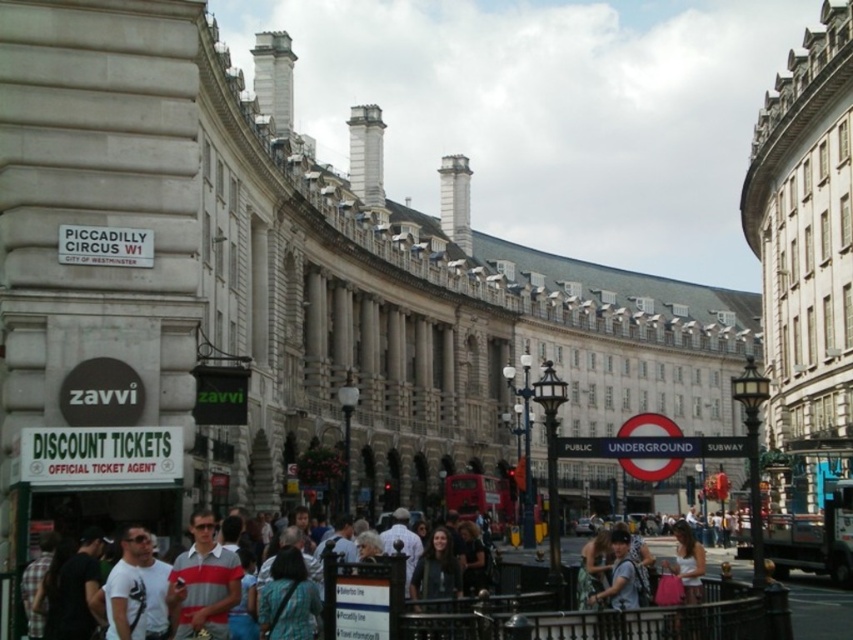
Does light blue shirt at center have a smaller size compared to striped polo shirt at center?

Actually, light blue shirt at center might be larger than striped polo shirt at center.

Where is `light blue shirt at center`? The image size is (853, 640). light blue shirt at center is located at coordinates (399, 598).

The height and width of the screenshot is (640, 853). Identify the location of light blue shirt at center. (399, 598).